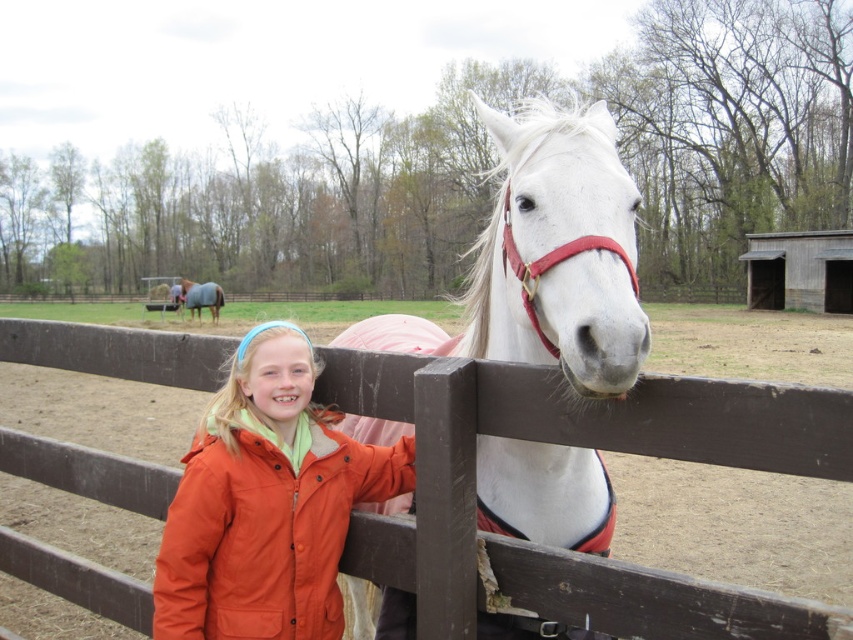
You are a farmer who needs to find the gray felt blanket at upper left for the horse. Based on the scene, where should you look relative to the white glossy horse at center?

The white glossy horse at center is located below the gray felt blanket at upper left, so you should look above the white glossy horse at center to find the gray felt blanket at upper left.

You are a photographer trying to capture the orange matte jacket at lower left and the gray felt blanket at upper left in the same frame. Which object should you focus on first to ensure both are in focus?

The orange matte jacket at lower left is closer to the viewer than the gray felt blanket at upper left. To ensure both are in focus, you should focus on the orange matte jacket at lower left first, as it is the closer object.

You are a photographer trying to capture the girl and the horse in a single shot. The brown wooden fence at center and orange matte jacket at lower left are in your viewfinder. Which object is closer to the left side of your camera frame?

The orange matte jacket at lower left is closer to the left side of the camera frame because the brown wooden fence at center is positioned to its right.